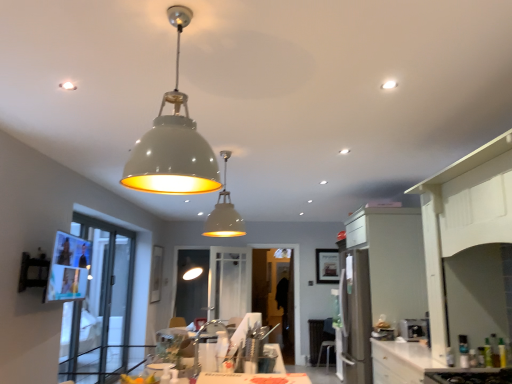
Question: Should I look upward or downward to see transparent glass door at center, the 1th glass door viewed from the right?

Choices:
 (A) down
 (B) up

Answer: (A)

Question: From the image's perspective, is satin silver toaster at lower right, positioned as the first appliance in right-to-left order, located beneath transparent glass door at center, the 1th glass door viewed from the right?

Choices:
 (A) yes
 (B) no

Answer: (B)

Question: Considering the relative positions of satin silver toaster at lower right, which ranks as the second appliance in left-to-right order, and transparent glass door at center, placed as the 1th glass door when sorted from back to front, in the image provided, is satin silver toaster at lower right, which ranks as the second appliance in left-to-right order, to the left of transparent glass door at center, placed as the 1th glass door when sorted from back to front, from the viewer's perspective?

Choices:
 (A) no
 (B) yes

Answer: (A)

Question: Does satin silver toaster at lower right, which ranks as the second appliance in left-to-right order, come in front of transparent glass door at center, which is the 2th glass door from front to back?

Choices:
 (A) no
 (B) yes

Answer: (B)

Question: Does satin silver toaster at lower right, positioned as the first appliance in right-to-left order, have a larger size compared to transparent glass door at center, which is the 2th glass door from front to back?

Choices:
 (A) no
 (B) yes

Answer: (A)

Question: Is satin silver toaster at lower right, which ranks as the second appliance in left-to-right order, oriented towards transparent glass door at center, the 1th glass door viewed from the right?

Choices:
 (A) yes
 (B) no

Answer: (B)

Question: Is satin silver toaster at lower right, which ranks as the second appliance in left-to-right order, touching transparent glass door at center, the 1th glass door viewed from the right?

Choices:
 (A) no
 (B) yes

Answer: (A)

Question: Is the depth of satin silver toaster at lower right, positioned as the first appliance in right-to-left order, less than that of white glossy cabinet at right?

Choices:
 (A) no
 (B) yes

Answer: (A)

Question: Is satin silver toaster at lower right, which ranks as the second appliance in left-to-right order, turned away from white glossy cabinet at right?

Choices:
 (A) yes
 (B) no

Answer: (B)

Question: Is satin silver toaster at lower right, positioned as the first appliance in right-to-left order, directly adjacent to white glossy cabinet at right?

Choices:
 (A) no
 (B) yes

Answer: (A)

Question: Would you say satin silver toaster at lower right, which ranks as the second appliance in left-to-right order, is outside white glossy cabinet at right?

Choices:
 (A) no
 (B) yes

Answer: (B)

Question: Is there a large distance between satin silver toaster at lower right, positioned as the first appliance in right-to-left order, and white glossy cabinet at right?

Choices:
 (A) yes
 (B) no

Answer: (A)

Question: From the image's perspective, is satin silver toaster at lower right, positioned as the first appliance in right-to-left order, below white glossy cabinet at right?

Choices:
 (A) yes
 (B) no

Answer: (A)

Question: From the image's perspective, is transparent glass door at left, which is counted as the 1th glass door, starting from the front, beneath white glossy countertop at lower right?

Choices:
 (A) no
 (B) yes

Answer: (B)